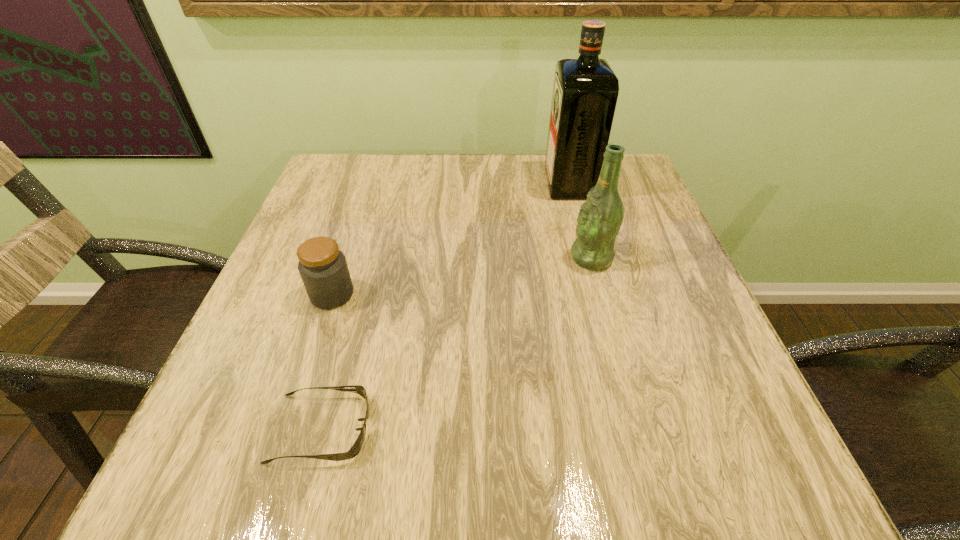
Locate an element on the screen. The width and height of the screenshot is (960, 540). liquor is located at coordinates (585, 91).

Image resolution: width=960 pixels, height=540 pixels. I want to click on the tallest object, so click(585, 91).

The image size is (960, 540). Find the location of `the second farthest object`. the second farthest object is located at coordinates (599, 220).

You are a GUI agent. You are given a task and a screenshot of the screen. Output one action in this format:
    pyautogui.click(x=<x>, y=<y>)
    Task: Click on the second tallest object
    The height and width of the screenshot is (540, 960).
    Given the screenshot: What is the action you would take?
    pyautogui.click(x=599, y=220)

Where is `the second shortest object`? The height and width of the screenshot is (540, 960). the second shortest object is located at coordinates (322, 266).

Locate an element on the screen. the second nearest object is located at coordinates (322, 266).

Identify the location of the shortest object. This screenshot has width=960, height=540. (355, 449).

Where is `the nearest object`? the nearest object is located at coordinates (355, 449).

The width and height of the screenshot is (960, 540). Find the location of `vacant space located on the front label of the liquor`. vacant space located on the front label of the liquor is located at coordinates (467, 184).

The width and height of the screenshot is (960, 540). I want to click on vacant space located on the front label of the liquor, so [x=432, y=184].